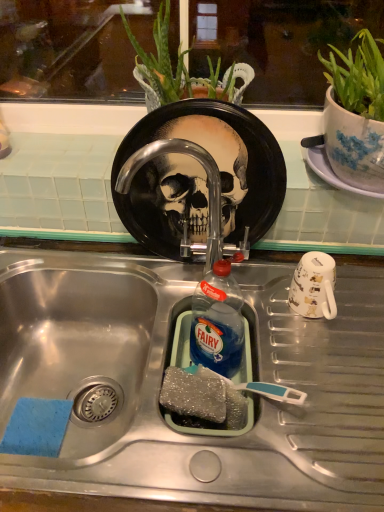
Identify the location of free space in front of white glossy mug at right. The width and height of the screenshot is (384, 512). (314, 404).